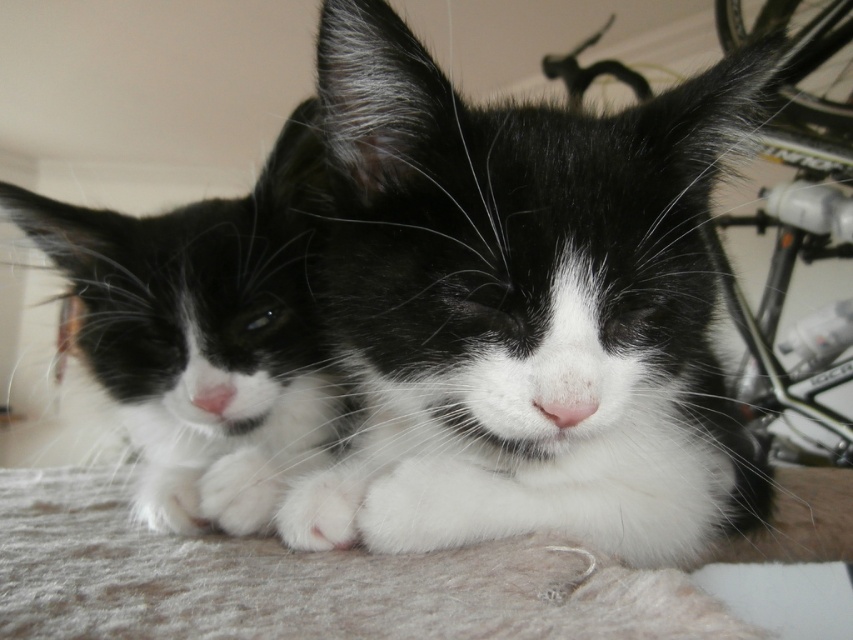
Question: Considering the relative positions of black soft fur cat at center and soft fur cat at center in the image provided, where is black soft fur cat at center located with respect to soft fur cat at center?

Choices:
 (A) above
 (B) below

Answer: (A)

Question: Can you confirm if black soft fur cat at center is positioned below soft fur cat at center?

Choices:
 (A) no
 (B) yes

Answer: (A)

Question: Is black soft fur cat at center above soft fur cat at center?

Choices:
 (A) yes
 (B) no

Answer: (A)

Question: Which point appears closest to the camera in this image?

Choices:
 (A) (252, 454)
 (B) (502, 200)

Answer: (B)

Question: Which object appears closest to the camera in this image?

Choices:
 (A) black soft fur cat at center
 (B) soft fur cat at center

Answer: (A)